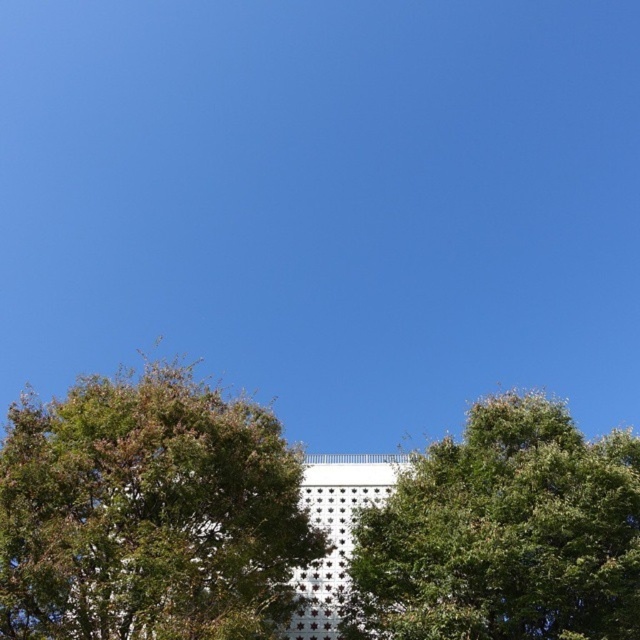
You are standing at the origin point of the image coordinate system. The origin is at the bottom left corner. The x and y coordinates increase to the right and upwards respectively. You want to walk to the green leafy tree at center. In which direction should you move first?

The green leafy tree at center is located at coordinates point [148,513]. Since the origin is at the bottom left corner, the x coordinate 0.803 indicates a position to the right, and the y coordinate 0.233 indicates a position slightly above. Therefore, you should move to the right first to reach the green leafy tree at center.

You are standing in a garden and see the green leafy tree at center and the green leafy tree at upper center. Which tree is closer to you?

The green leafy tree at center is closer to you because it is in front of the green leafy tree at upper center.

You are standing in a park and see the green leafy tree at center and the green leafy tree at upper center. Which tree would block your view of the white building with a patterned facade if you stand directly in front of them?

The green leafy tree at center would block your view of the white building with a patterned facade because it is bigger than the green leafy tree at upper center.